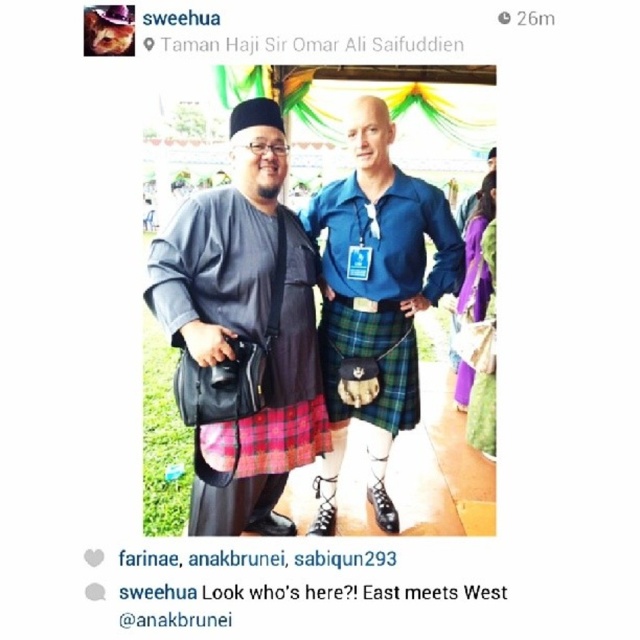
Is matte black kilt at center thinner than plaid fabric kilt at center?

No.

Find the location of a particular element. matte black kilt at center is located at coordinates (243, 332).

Is point (413, 300) positioned in front of point (332, 381)?

Yes, it is.

Who is more forward, (442, 225) or (378, 307)?

Positioned in front is point (378, 307).

This screenshot has width=640, height=640. What do you see at coordinates (374, 300) in the screenshot? I see `blue plaid kilt at center` at bounding box center [374, 300].

Locate an element on the screen. This screenshot has width=640, height=640. blue plaid kilt at center is located at coordinates (374, 300).

Describe the element at coordinates (243, 332) in the screenshot. The width and height of the screenshot is (640, 640). I see `matte black kilt at center` at that location.

Find the location of a particular element. The width and height of the screenshot is (640, 640). matte black kilt at center is located at coordinates (243, 332).

Describe the element at coordinates (243, 332) in the screenshot. I see `matte black kilt at center` at that location.

Where is `matte black kilt at center`? The image size is (640, 640). matte black kilt at center is located at coordinates (243, 332).